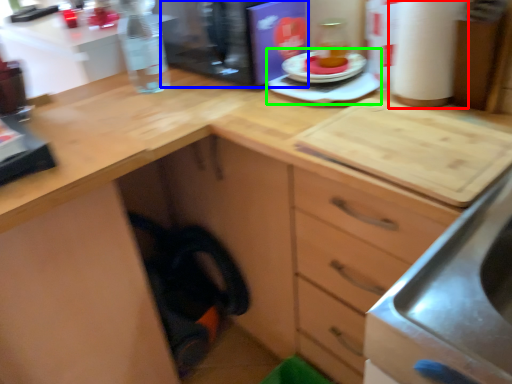
Question: Considering the real-world distances, which object is closest to paper towel (highlighted by a red box)? appliance (highlighted by a blue box) or appliance (highlighted by a green box).

Choices:
 (A) appliance
 (B) appliance

Answer: (B)